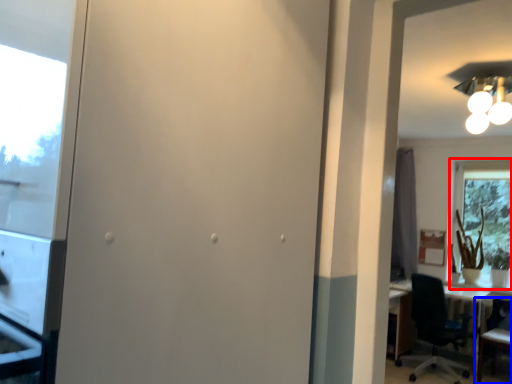
Question: Which object appears farthest to the camera in this image, window (highlighted by a red box) or chair (highlighted by a blue box)?

Choices:
 (A) window
 (B) chair

Answer: (A)